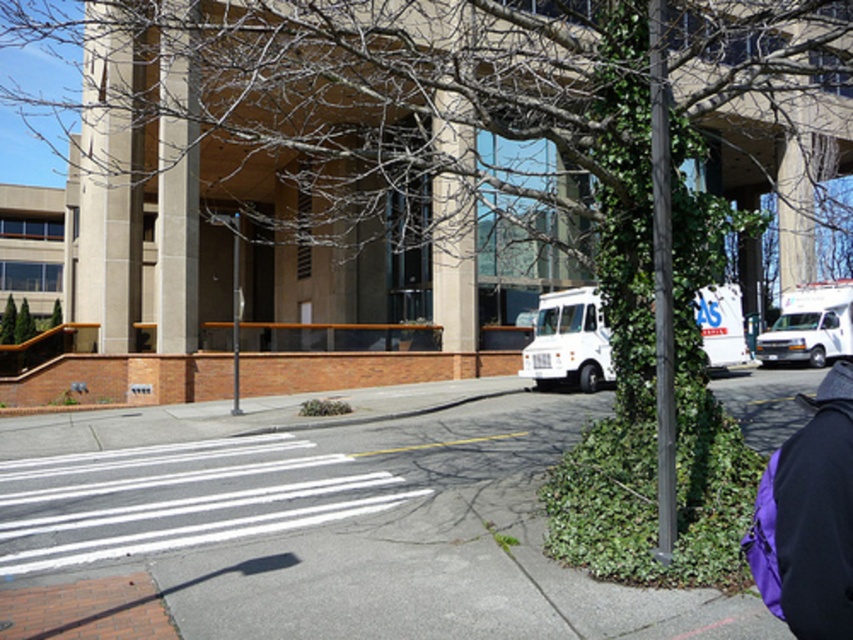
You are driving a delivery truck and need to park it in the parking lot near the gray asphalt at center and the white matte van at right. According to the scene, where should you park your truck so it doesn

The gray asphalt at center is to the left of the white matte van at right, so you should park your truck to the left of the white matte van at right near the gray asphalt at center.